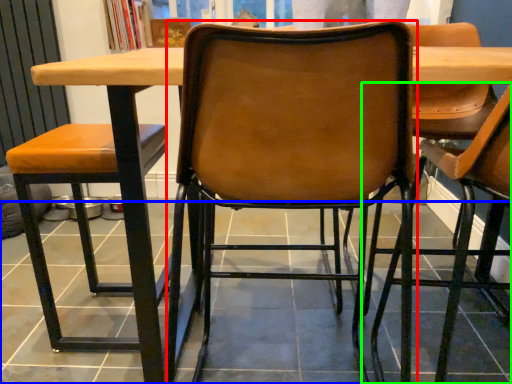
Question: Which object is positioned closest to chair (highlighted by a red box)? Select from tile (highlighted by a blue box) and chair (highlighted by a green box).

Choices:
 (A) tile
 (B) chair

Answer: (A)